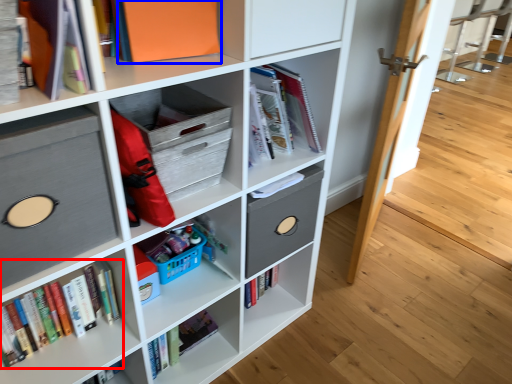
Question: Which object appears closest to the camera in this image, book (highlighted by a red box) or paperback book (highlighted by a blue box)?

Choices:
 (A) book
 (B) paperback book

Answer: (B)